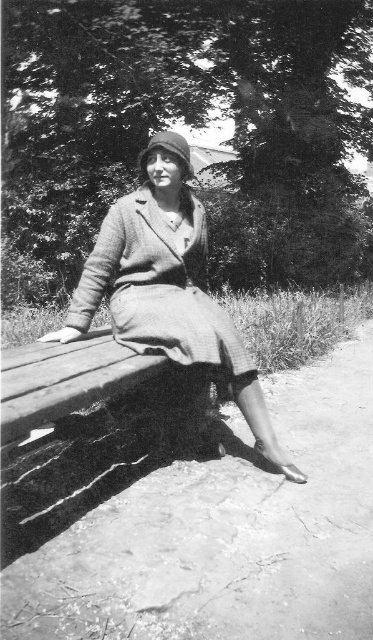
Question: Does coarse woolen coat at center come in front of matte brown hat at upper center?

Choices:
 (A) no
 (B) yes

Answer: (B)

Question: Considering the relative positions of coarse woolen coat at center and matte brown hat at upper center in the image provided, where is coarse woolen coat at center located with respect to matte brown hat at upper center?

Choices:
 (A) above
 (B) below

Answer: (B)

Question: Is coarse woolen coat at center in front of textured wool dress at center?

Choices:
 (A) no
 (B) yes

Answer: (A)

Question: Which of the following is the farthest from the observer?

Choices:
 (A) textured wool dress at center
 (B) coarse woolen coat at center

Answer: (B)

Question: Considering the real-world distances, which object is farthest from the textured wool dress at center?

Choices:
 (A) coarse woolen coat at center
 (B) matte brown hat at upper center

Answer: (B)

Question: Which point is closer to the camera taking this photo?

Choices:
 (A) (189, 164)
 (B) (183, 326)

Answer: (B)